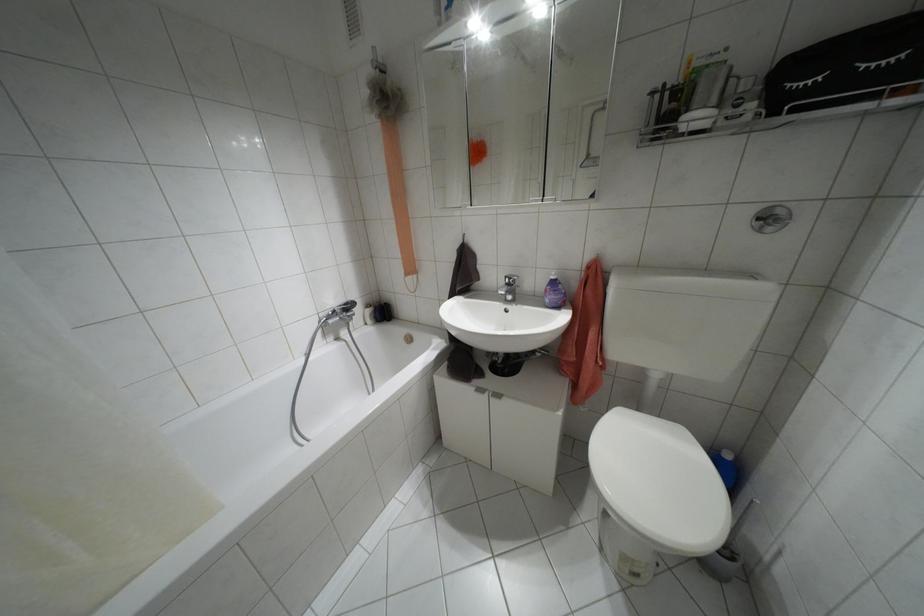
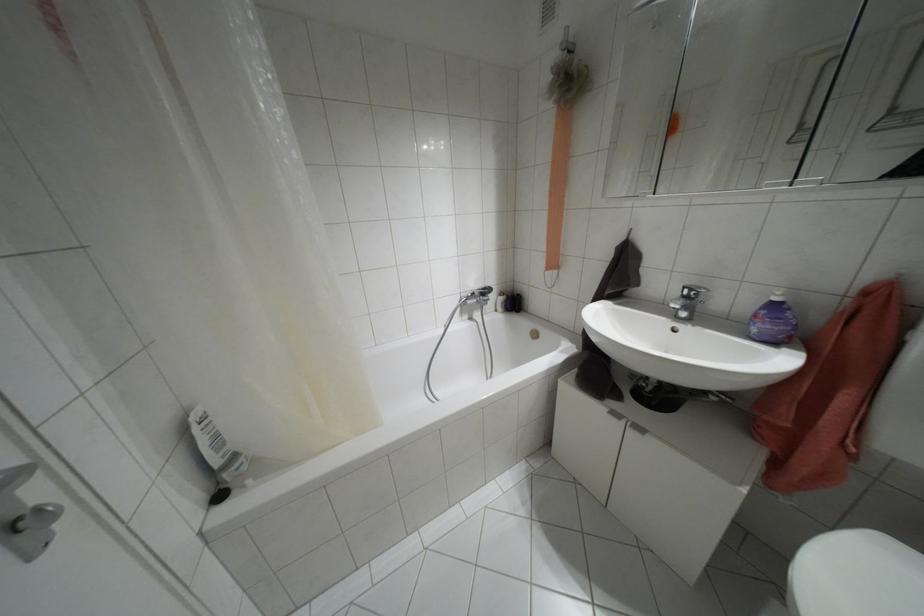
Question: The camera is either moving clockwise (left) or counter-clockwise (right) around the object. The first image is from the beginning of the video and the second image is from the end. Is the camera moving left or right when shooting the video?

Choices:
 (A) Left
 (B) Right

Answer: (B)